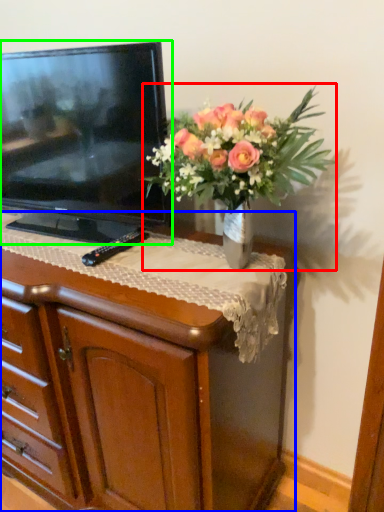
Question: Which object is the closest to the houseplant (highlighted by a red box)? Choose among these: chest of drawers (highlighted by a blue box) or television (highlighted by a green box).

Choices:
 (A) chest of drawers
 (B) television

Answer: (B)